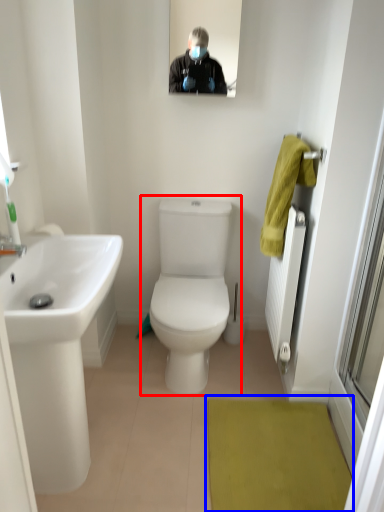
Question: Which object is further to the camera taking this photo, toilet (highlighted by a red box) or bath mat (highlighted by a blue box)?

Choices:
 (A) toilet
 (B) bath mat

Answer: (A)